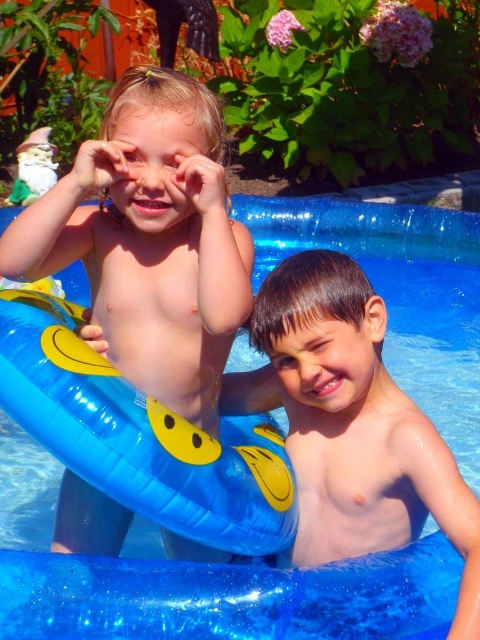
Question: Is blue rubber pool at center smaller than smooth skin boy at center?

Choices:
 (A) yes
 (B) no

Answer: (B)

Question: Estimate the real-world distances between objects in this image. Which object is closer to the blue rubber pool at center?

Choices:
 (A) smooth skin boy at center
 (B) matte yellow float at left

Answer: (A)

Question: Which point is closer to the camera?

Choices:
 (A) matte yellow float at left
 (B) blue rubber pool at center

Answer: (A)

Question: Which point appears farthest from the camera in this image?

Choices:
 (A) (180, 141)
 (B) (475, 572)

Answer: (A)

Question: Is matte yellow float at left to the right of smooth skin boy at center from the viewer's perspective?

Choices:
 (A) no
 (B) yes

Answer: (A)

Question: Where is blue rubber pool at center located in relation to matte yellow float at left in the image?

Choices:
 (A) right
 (B) left

Answer: (A)